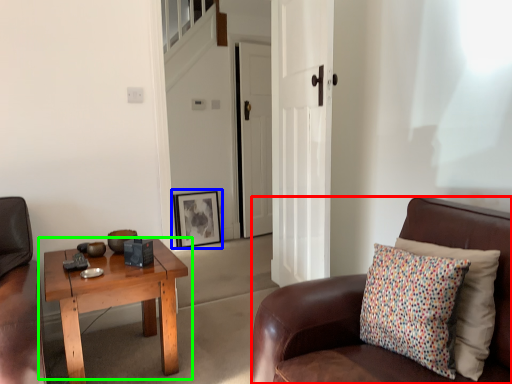
Question: Which object is positioned closest to chair (highlighted by a red box)? Select from picture frame (highlighted by a blue box) and coffee table (highlighted by a green box).

Choices:
 (A) picture frame
 (B) coffee table

Answer: (B)